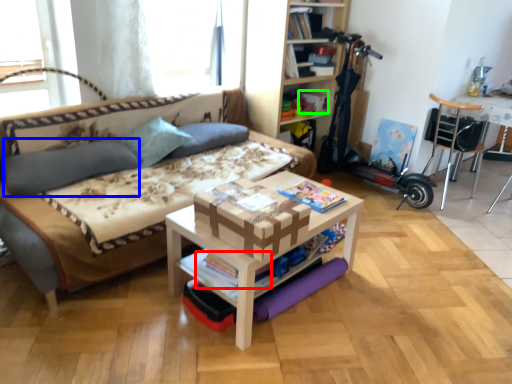
Question: Which object is the closest to the magazine (highlighted by a red box)? Choose among these: pillow (highlighted by a blue box) or storage box (highlighted by a green box).

Choices:
 (A) pillow
 (B) storage box

Answer: (A)